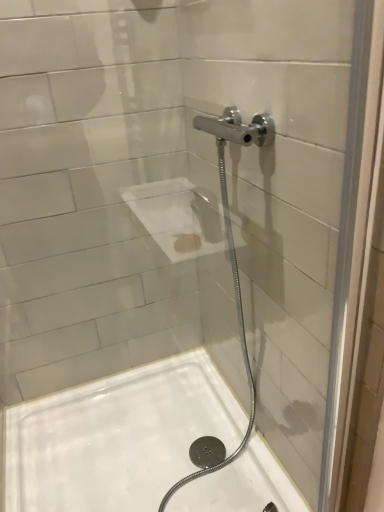
Question: Is white glossy bath at lower left wider or thinner than transparent glass door at upper center?

Choices:
 (A) wide
 (B) thin

Answer: (A)

Question: From a real-world perspective, relative to transparent glass door at upper center, is white glossy bath at lower left vertically above or below?

Choices:
 (A) below
 (B) above

Answer: (A)

Question: Based on their sizes in the image, would you say white glossy bath at lower left is bigger or smaller than transparent glass door at upper center?

Choices:
 (A) small
 (B) big

Answer: (B)

Question: In the image, is transparent glass door at upper center positioned in front of or behind white glossy bath at lower left?

Choices:
 (A) front
 (B) behind

Answer: (A)

Question: From the image's perspective, is transparent glass door at upper center positioned above or below white glossy bath at lower left?

Choices:
 (A) below
 (B) above

Answer: (B)

Question: From a real-world perspective, relative to white glossy bath at lower left, is transparent glass door at upper center vertically above or below?

Choices:
 (A) below
 (B) above

Answer: (B)

Question: Is transparent glass door at upper center taller or shorter than white glossy bath at lower left?

Choices:
 (A) tall
 (B) short

Answer: (A)